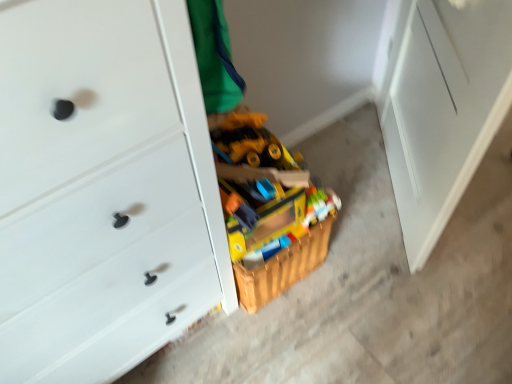
Question: Would you say white matte file cabinet at right is outside wooden toy box at center?

Choices:
 (A) no
 (B) yes

Answer: (B)

Question: Can you confirm if white matte file cabinet at right is shorter than wooden toy box at center?

Choices:
 (A) yes
 (B) no

Answer: (B)

Question: Is white matte file cabinet at right at the right side of wooden toy box at center?

Choices:
 (A) yes
 (B) no

Answer: (A)

Question: Can you confirm if white matte file cabinet at right is positioned to the left of wooden toy box at center?

Choices:
 (A) no
 (B) yes

Answer: (A)

Question: Is white matte file cabinet at right not near wooden toy box at center?

Choices:
 (A) no
 (B) yes

Answer: (A)

Question: Is white matte file cabinet at right wider or thinner than white matte chest of drawers at center?

Choices:
 (A) wide
 (B) thin

Answer: (B)

Question: In the image, is white matte file cabinet at right on the left side or the right side of white matte chest of drawers at center?

Choices:
 (A) right
 (B) left

Answer: (A)

Question: Is white matte file cabinet at right in front of or behind white matte chest of drawers at center in the image?

Choices:
 (A) behind
 (B) front

Answer: (A)

Question: Is point (436, 11) positioned closer to the camera than point (99, 130)?

Choices:
 (A) farther
 (B) closer

Answer: (A)

Question: From the image's perspective, is white matte file cabinet at right above or below wooden toy box at center?

Choices:
 (A) below
 (B) above

Answer: (B)

Question: Is white matte file cabinet at right spatially inside wooden toy box at center, or outside of it?

Choices:
 (A) inside
 (B) outside

Answer: (B)

Question: From their relative heights in the image, would you say white matte file cabinet at right is taller or shorter than wooden toy box at center?

Choices:
 (A) tall
 (B) short

Answer: (A)

Question: Is white matte file cabinet at right bigger or smaller than wooden toy box at center?

Choices:
 (A) big
 (B) small

Answer: (B)

Question: Relative to wooden toy box at center, is white matte chest of drawers at center in front or behind?

Choices:
 (A) front
 (B) behind

Answer: (A)

Question: In terms of size, does white matte chest of drawers at center appear bigger or smaller than wooden toy box at center?

Choices:
 (A) big
 (B) small

Answer: (A)